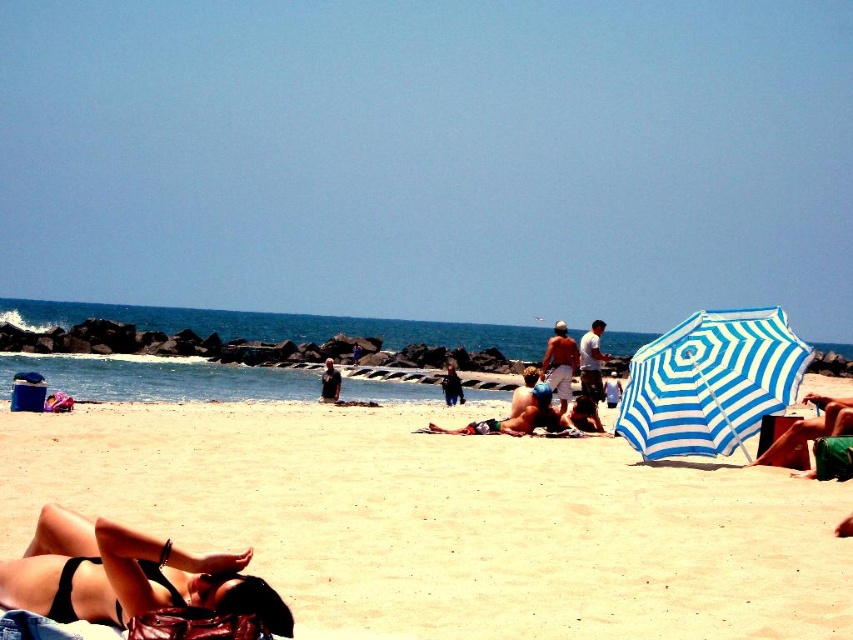
You are standing on the beach and want to reach both the point at coordinates point (15, 595) and the point at coordinates point (461, 394). Which point will you reach first as you walk forward?

You will reach point (15, 595) first because it is closer to you than point (461, 394).

Looking at this image, you are a photographer standing at the camera position. You want to take a photo of both the point at coordinates point [672,426] and point [331,365]. Which point will appear larger in your photo?

Point [672,426] is closer to the camera than point [331,365], so it will appear larger in the photo.